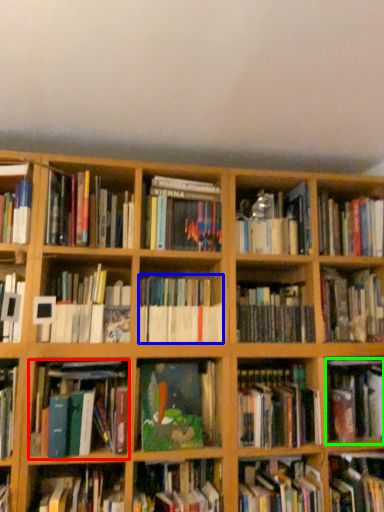
Question: Which object is positioned farthest from book (highlighted by a red box)? Select from book (highlighted by a blue box) and book (highlighted by a green box).

Choices:
 (A) book
 (B) book

Answer: (B)